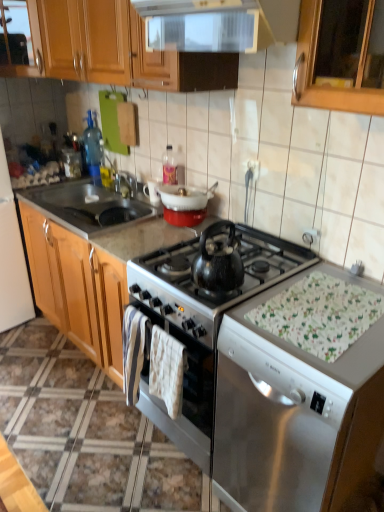
Question: From the image's perspective, is white glossy refrigerator at left, the 2th appliance viewed from the right, below wooden cabinet at upper left?

Choices:
 (A) no
 (B) yes

Answer: (B)

Question: Is white glossy refrigerator at left, the 2th appliance viewed from the right, smaller than wooden cabinet at upper left?

Choices:
 (A) yes
 (B) no

Answer: (B)

Question: Does white glossy refrigerator at left, which appears as the 1th appliance when viewed from the left, have a greater width compared to wooden cabinet at upper left?

Choices:
 (A) yes
 (B) no

Answer: (A)

Question: Considering the relative sizes of white glossy refrigerator at left, the 2th appliance viewed from the right, and wooden cabinet at upper left in the image provided, is white glossy refrigerator at left, the 2th appliance viewed from the right, thinner than wooden cabinet at upper left?

Choices:
 (A) yes
 (B) no

Answer: (B)

Question: Is white glossy refrigerator at left, which appears as the 1th appliance when viewed from the left, positioned behind wooden cabinet at upper left?

Choices:
 (A) no
 (B) yes

Answer: (A)

Question: Based on their sizes in the image, would you say metallic stainless steel sink at left, positioned as the 2th sink in right-to-left order, is bigger or smaller than white fabric placemat at lower right?

Choices:
 (A) big
 (B) small

Answer: (A)

Question: From the image's perspective, is metallic stainless steel sink at left, positioned as the 1th sink in left-to-right order, above or below white fabric placemat at lower right?

Choices:
 (A) above
 (B) below

Answer: (A)

Question: Is metallic stainless steel sink at left, positioned as the 2th sink in right-to-left order, taller or shorter than white fabric placemat at lower right?

Choices:
 (A) tall
 (B) short

Answer: (A)

Question: Is metallic stainless steel sink at left, positioned as the 2th sink in right-to-left order, in front of or behind white fabric placemat at lower right in the image?

Choices:
 (A) behind
 (B) front

Answer: (A)

Question: Considering the positions of satin black kettle at center, which appears as the 2th appliance when viewed from the left, and black stainless steel sink at left, the second sink in the left-to-right sequence, in the image, is satin black kettle at center, which appears as the 2th appliance when viewed from the left, bigger or smaller than black stainless steel sink at left, the second sink in the left-to-right sequence,?

Choices:
 (A) big
 (B) small

Answer: (A)

Question: Is point pyautogui.click(x=220, y=309) positioned closer to the camera than point pyautogui.click(x=104, y=203)?

Choices:
 (A) farther
 (B) closer

Answer: (B)

Question: Relative to black stainless steel sink at left, the second sink in the left-to-right sequence, is satin black kettle at center, which appears as the 2th appliance when viewed from the left, in front or behind?

Choices:
 (A) front
 (B) behind

Answer: (A)

Question: Is satin black kettle at center, which appears as the first appliance when viewed from the right, inside the boundaries of black stainless steel sink at left, which appears as the 1th sink when viewed from the right, or outside?

Choices:
 (A) inside
 (B) outside

Answer: (B)

Question: From the image's perspective, is white fabric placemat at lower right located above or below white textured towel at center?

Choices:
 (A) above
 (B) below

Answer: (A)

Question: Considering the relative positions of white fabric placemat at lower right and white textured towel at center in the image provided, is white fabric placemat at lower right to the left or to the right of white textured towel at center?

Choices:
 (A) left
 (B) right

Answer: (B)